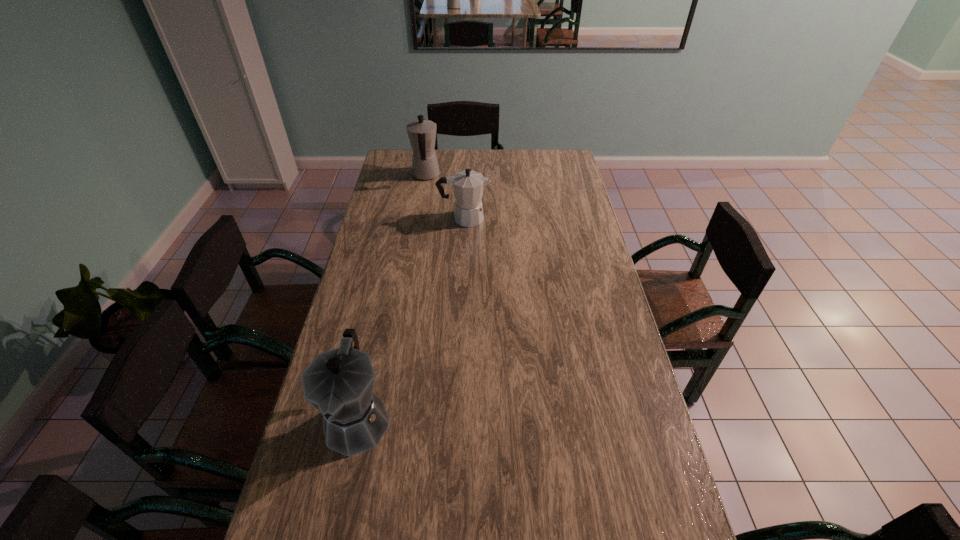
This screenshot has height=540, width=960. In the image, there is a desktop. What are the coordinates of `vacant space at the right edge` in the screenshot? It's located at (655, 470).

You are a GUI agent. You are given a task and a screenshot of the screen. Output one action in this format:
    pyautogui.click(x=<x>, y=<y>)
    Task: Click on the vacant region between the nearest object and the second nearest object
    
    Given the screenshot: What is the action you would take?
    pyautogui.click(x=411, y=319)

Find the location of a particular element. This screenshot has height=540, width=960. free space between the shortest coffeepot and the nearest coffeepot is located at coordinates (411, 319).

Where is `vacant region between the nearest coffeepot and the second nearest coffeepot`? vacant region between the nearest coffeepot and the second nearest coffeepot is located at coordinates (411, 319).

The image size is (960, 540). In order to click on object that is the closest to the nearest coffeepot in this screenshot , I will do `click(468, 186)`.

Identify which object is located as the nearest to the nearest object. Please provide its 2D coordinates. Your answer should be formatted as a tuple, i.e. [(x, y)], where the tuple contains the x and y coordinates of a point satisfying the conditions above.

[(468, 186)]

Select which coffeepot appears as the second closest to the nearest object. Please provide its 2D coordinates. Your answer should be formatted as a tuple, i.e. [(x, y)], where the tuple contains the x and y coordinates of a point satisfying the conditions above.

[(422, 133)]

You are a GUI agent. You are given a task and a screenshot of the screen. Output one action in this format:
    pyautogui.click(x=<x>, y=<y>)
    Task: Click on the coffeepot that stands as the closest to the rightmost coffeepot
    This screenshot has height=540, width=960.
    Given the screenshot: What is the action you would take?
    pyautogui.click(x=422, y=133)

Find the location of a particular element. Image resolution: width=960 pixels, height=540 pixels. free space that satisfies the following two spatial constraints: 1. at the spout of the shortest coffeepot; 2. at the spout of the nearest object is located at coordinates (455, 419).

Identify the location of vacant space that satisfies the following two spatial constraints: 1. at the spout of the second farthest coffeepot; 2. at the spout of the nearest object. (455, 419).